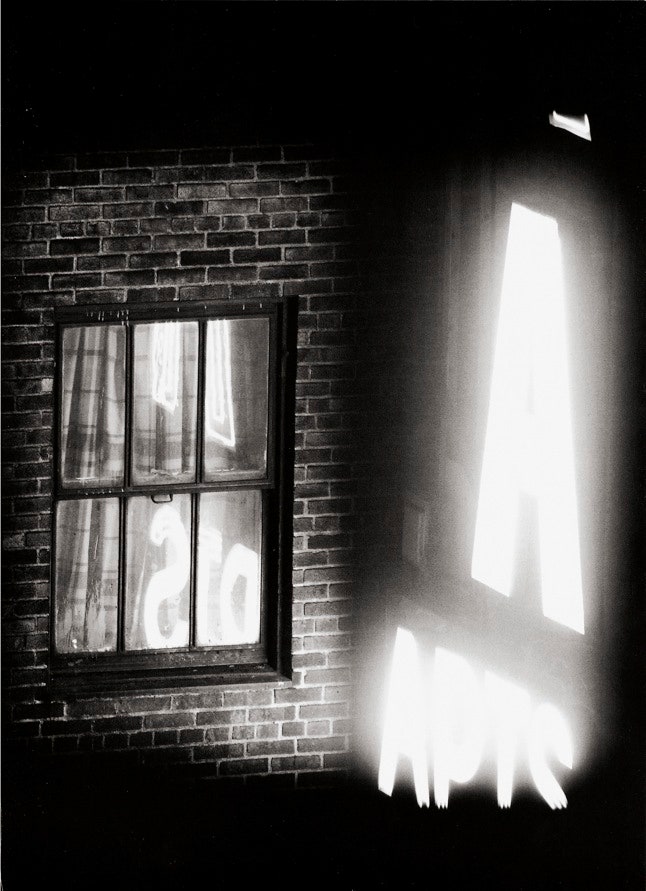
The height and width of the screenshot is (891, 646). I want to click on window panel, so click(225, 374), click(174, 413), click(108, 407), click(94, 577), click(158, 571), click(252, 569).